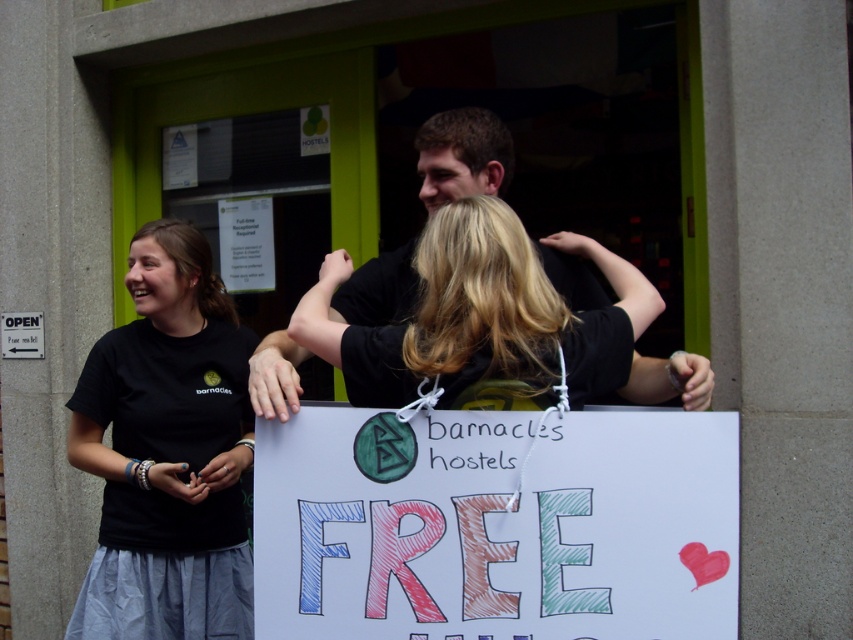
Question: Which point is closer to the camera?

Choices:
 (A) (498, 541)
 (B) (456, 269)
 (C) (149, 525)

Answer: (A)

Question: Which point appears farthest from the camera in this image?

Choices:
 (A) (181, 433)
 (B) (563, 547)
 (C) (521, 257)

Answer: (A)

Question: From the image, what is the correct spatial relationship of black cotton t-shirt at left in relation to black matte shirt at center?

Choices:
 (A) left
 (B) right

Answer: (A)

Question: Which point is closer to the camera?

Choices:
 (A) (474, 292)
 (B) (392, 474)
 (C) (177, 499)

Answer: (A)

Question: Can you confirm if black cotton t-shirt at left is thinner than black matte shirt at center?

Choices:
 (A) no
 (B) yes

Answer: (B)

Question: In this image, where is hand-drawn paper sign at center located relative to black cotton t-shirt at left?

Choices:
 (A) below
 (B) above

Answer: (A)